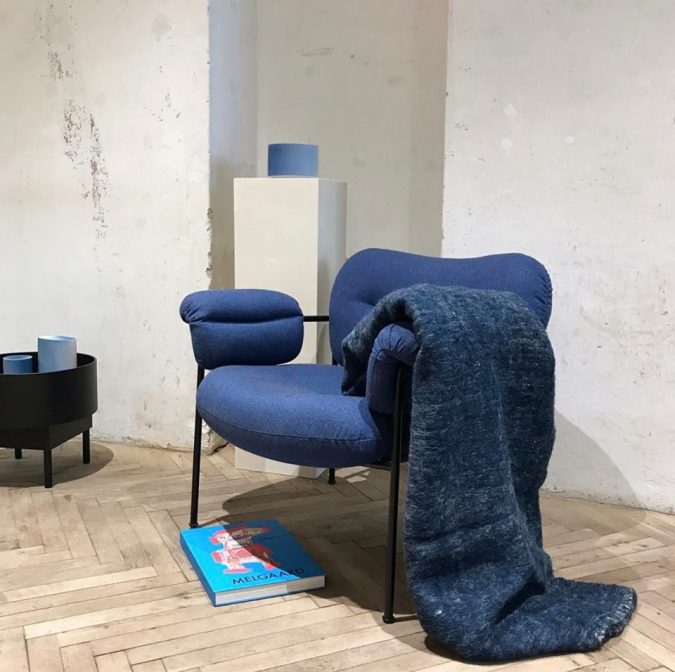
The height and width of the screenshot is (672, 675). I want to click on armrest, so click(252, 308), click(387, 337).